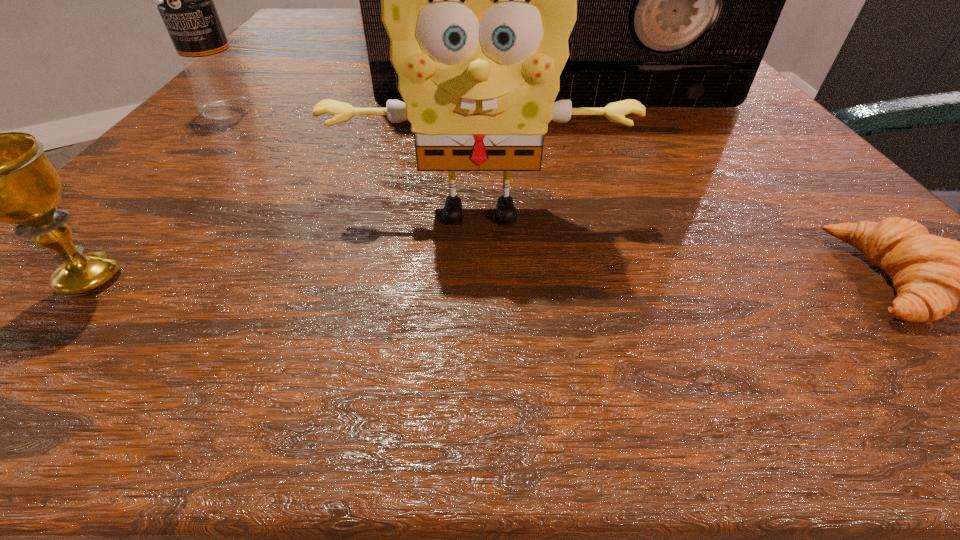
Select which object appears as the closest to the vodka. Please provide its 2D coordinates. Your answer should be formatted as a tuple, i.e. [(x, y)], where the tuple contains the x and y coordinates of a point satisfying the conditions above.

[(677, 0)]

Locate an element on the screen. The image size is (960, 540). object that is the third nearest to the vodka is located at coordinates (0, 177).

I want to click on free space that satisfies the following two spatial constraints: 1. on the label of the vodka; 2. on the right side of the second shortest object, so click(74, 278).